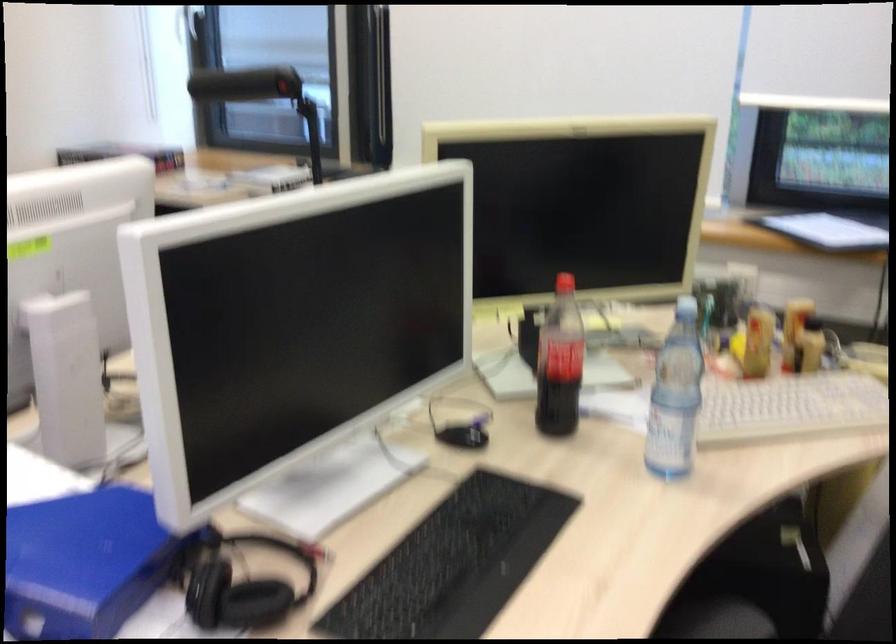
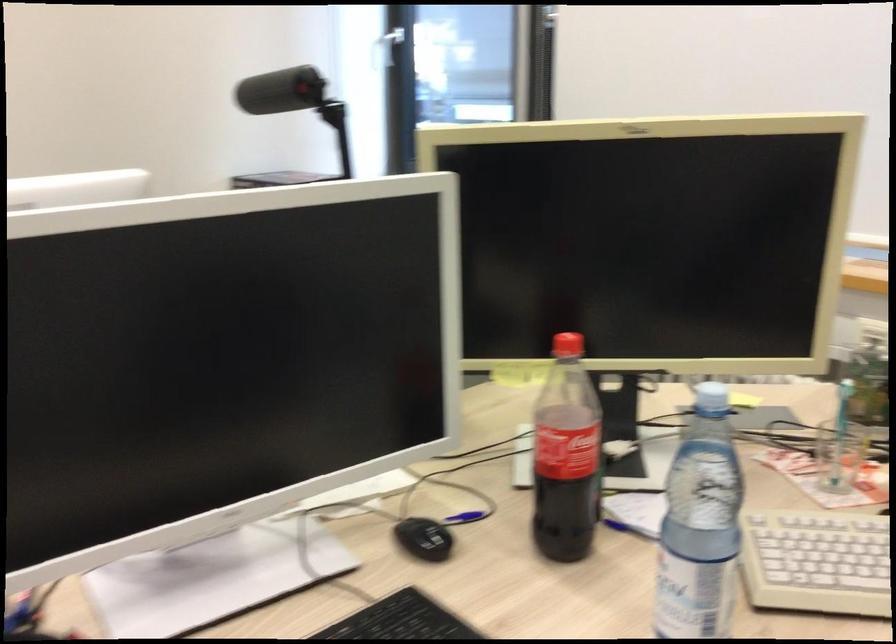
The point at (462, 437) is marked in the first image. Where is the corresponding point in the second image?

(424, 538)